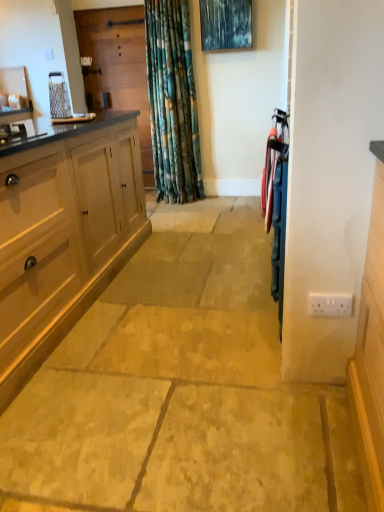
Question: Considering the positions of white plastic electric outlet at lower right and wooden screen door at upper left, which ranks as the 1th screen door in left-to-right order, in the image, is white plastic electric outlet at lower right wider or thinner than wooden screen door at upper left, which ranks as the 1th screen door in left-to-right order,?

Choices:
 (A) wide
 (B) thin

Answer: (B)

Question: Is white plastic electric outlet at lower right spatially inside wooden screen door at upper left, which is the 1th screen door in back-to-front order, or outside of it?

Choices:
 (A) outside
 (B) inside

Answer: (A)

Question: Which of these objects is positioned farthest from the white plastic electric outlet at lower right?

Choices:
 (A) wooden screen door at upper left, which is the 1th screen door in back-to-front order
 (B) metallic blue screen door at right, acting as the 2th screen door starting from the top
 (C) metallic blue painting at upper center

Answer: (A)

Question: Based on their relative distances, which object is farther from the wooden screen door at upper left, which ranks as the 1th screen door in left-to-right order?

Choices:
 (A) metallic blue screen door at right, the 2th screen door from the left
 (B) white plastic electric outlet at lower right
 (C) metallic blue painting at upper center

Answer: (B)